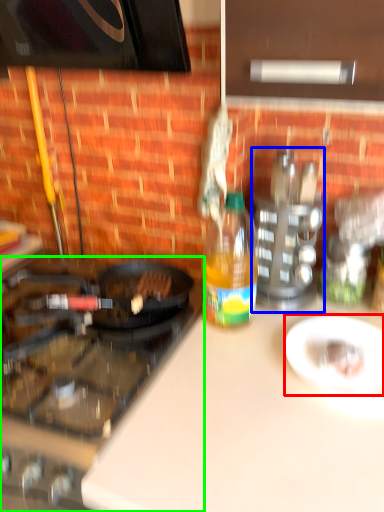
Question: Based on their relative distances, which object is farther from plate (highlighted by a red box)? Choose from appliance (highlighted by a blue box) and gas stove (highlighted by a green box).

Choices:
 (A) appliance
 (B) gas stove

Answer: (B)